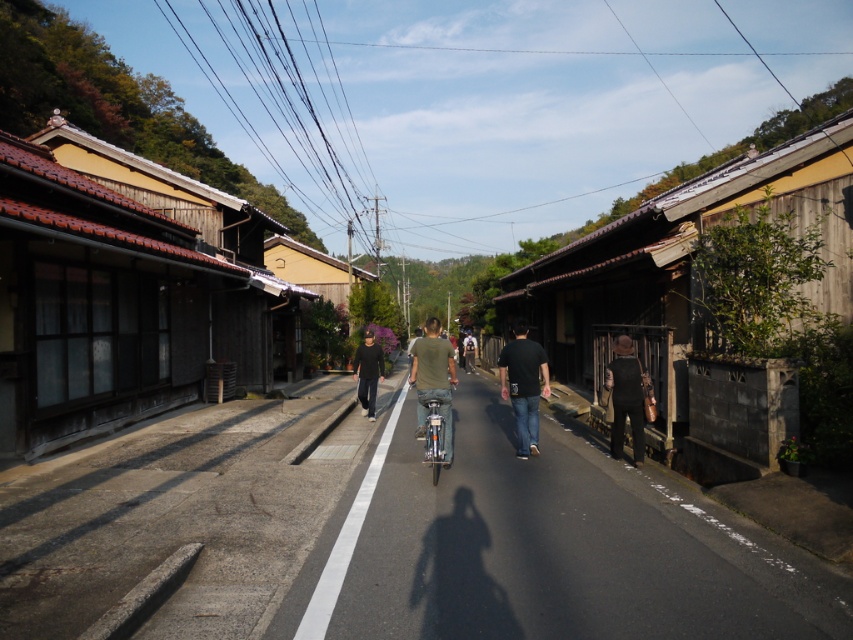
You are a delivery person with a cart that is 1.5 meters wide. You need to pass between the black matte shirt at center and the dark brown leather jacket at lower right. Is there enough space for your cart to fit through the gap between them?

The distance between the black matte shirt at center and the dark brown leather jacket at lower right is 2.11 meters. Since your cart is 1.5 meters wide, there is sufficient space to pass through the gap as 2.11 meters is wider than 1.5 meters.

You are standing on the street in the traditional Japanese village scene. You notice a point at coordinates (433,381). What object is this point located on?

The point at coordinates (433,381) is located on the green matte shirt at center.